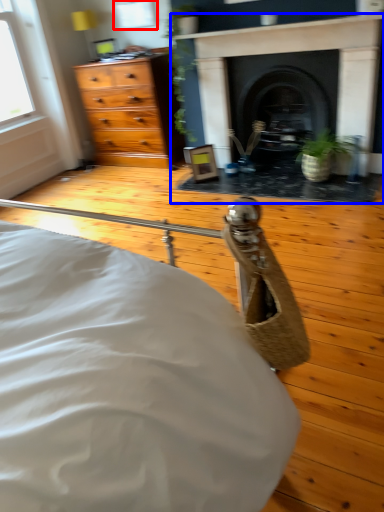
Question: Among these objects, which one is farthest to the camera, window (highlighted by a red box) or fireplace (highlighted by a blue box)?

Choices:
 (A) window
 (B) fireplace

Answer: (A)